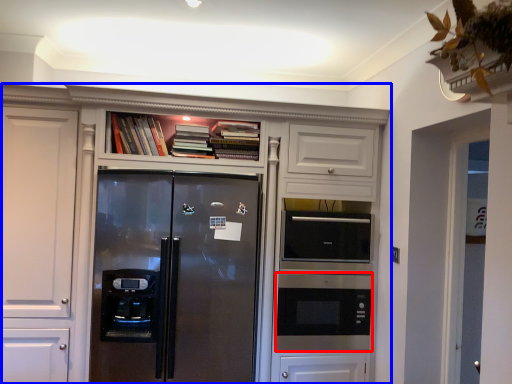
Question: Among these objects, which one is farthest to the camera, microwave oven (highlighted by a red box) or cupboard (highlighted by a blue box)?

Choices:
 (A) microwave oven
 (B) cupboard

Answer: (A)